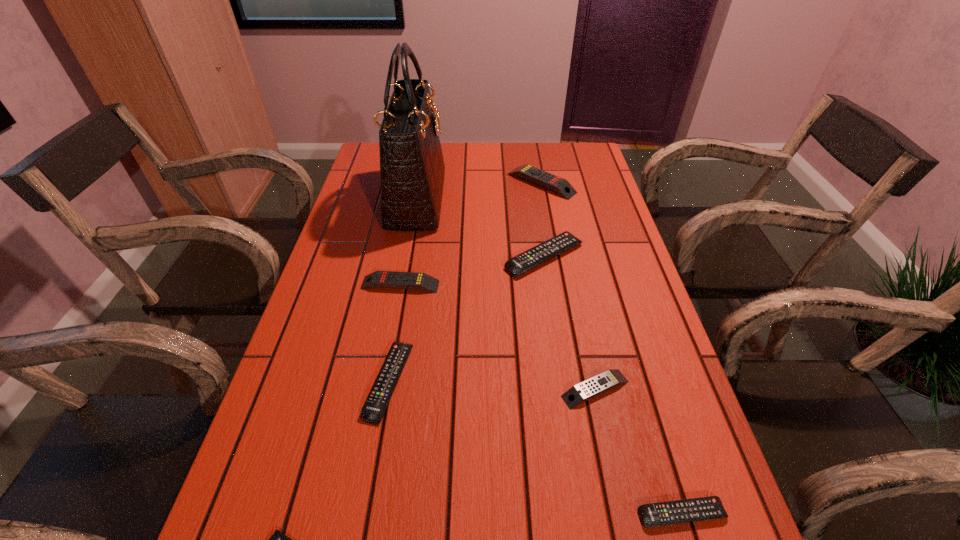
The image size is (960, 540). Find the location of `the tallest object`. the tallest object is located at coordinates (412, 169).

Where is `the farthest remote control`? the farthest remote control is located at coordinates (557, 184).

This screenshot has height=540, width=960. I want to click on the farthest yellow remote control, so click(557, 184).

Find the location of a particular element. This screenshot has height=540, width=960. the second farthest yellow remote control is located at coordinates (382, 279).

Locate an element on the screen. the second biggest yellow remote control is located at coordinates (382, 279).

The height and width of the screenshot is (540, 960). In order to click on the farthest black remote control in this screenshot , I will do `click(527, 260)`.

Locate an element on the screen. the second farthest black remote control is located at coordinates [372, 412].

This screenshot has height=540, width=960. In order to click on the second biggest black remote control in this screenshot , I will do `click(372, 412)`.

Find the location of a particular element. the nearest yellow remote control is located at coordinates (609, 379).

What are the coordinates of `the sixth tallest remote control` in the screenshot? It's located at (705, 508).